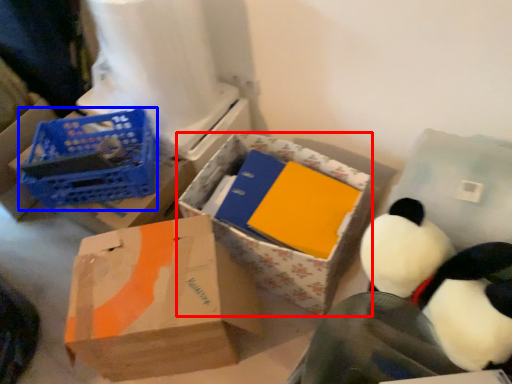
Question: Which of the following is the farthest to the observer, box (highlighted by a red box) or basket (highlighted by a blue box)?

Choices:
 (A) box
 (B) basket

Answer: (B)